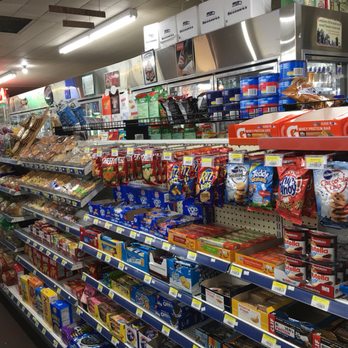
The height and width of the screenshot is (348, 348). I want to click on bottles in refrigerator, so click(x=318, y=67), click(x=325, y=78).